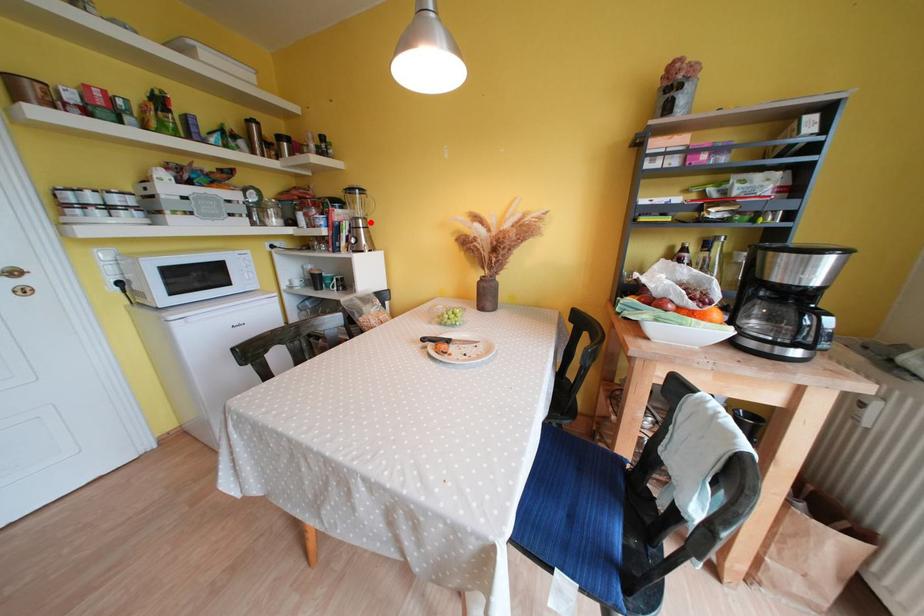
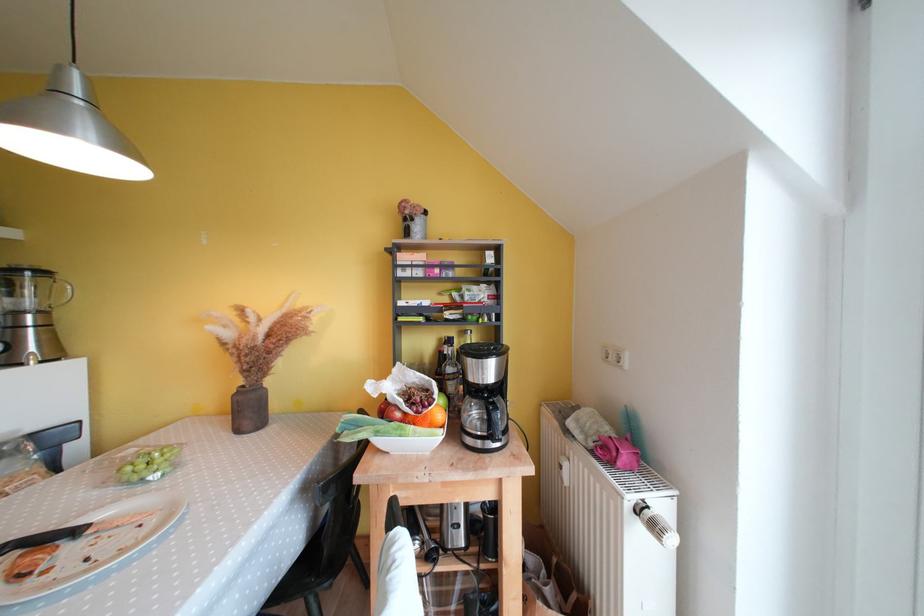
Question: I am providing you with two images of the same scene from different viewpoints. A red point is shown in image1. For the corresponding object point in image2, is it positioned nearer or farther from the camera?

Choices:
 (A) Nearer
 (B) Farther

Answer: (B)